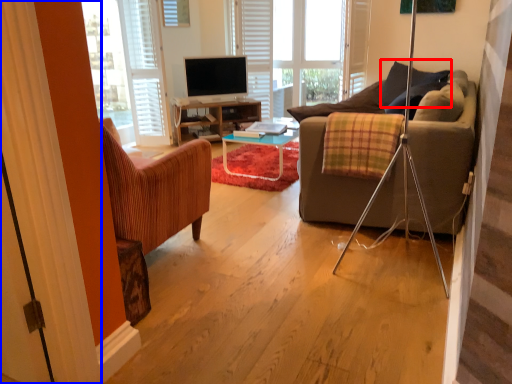
Question: Which object is closer to the camera taking this photo, pillow (highlighted by a red box) or curtain (highlighted by a blue box)?

Choices:
 (A) pillow
 (B) curtain

Answer: (B)